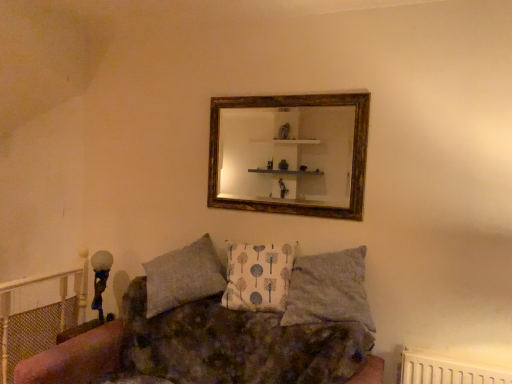
Image resolution: width=512 pixels, height=384 pixels. Identify the location of empty space that is ontop of gold-framed mirror at upper center. (288, 91).